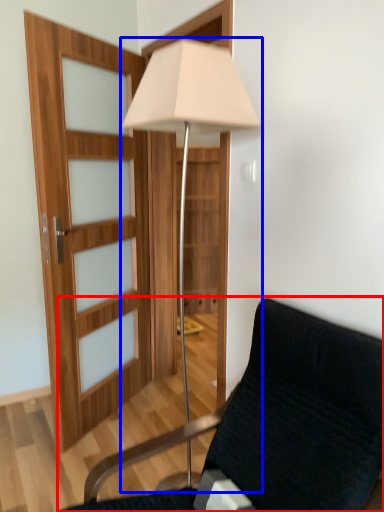
Question: Which object appears closest to the camera in this image, chair (highlighted by a red box) or lamp (highlighted by a blue box)?

Choices:
 (A) chair
 (B) lamp

Answer: (A)